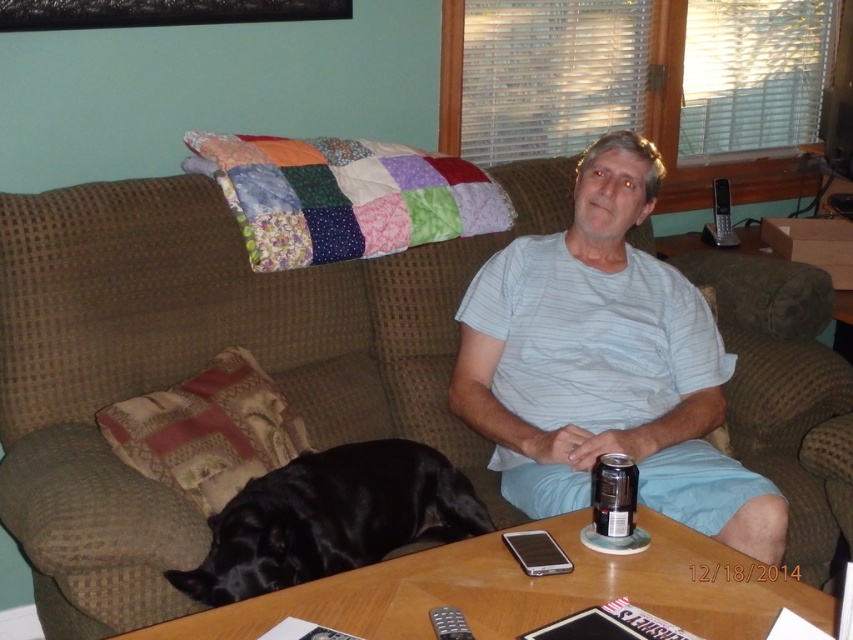
Consider the image. You are standing in the living room and want to place a small plant exactly at point [357,541]. If your arm can reach up to 1.5 meters, can you reach that point?

The distance of point [357,541] from camera is 1.56 meters, so you cannot reach it with an arm that can only extend up to 1.5 meters.